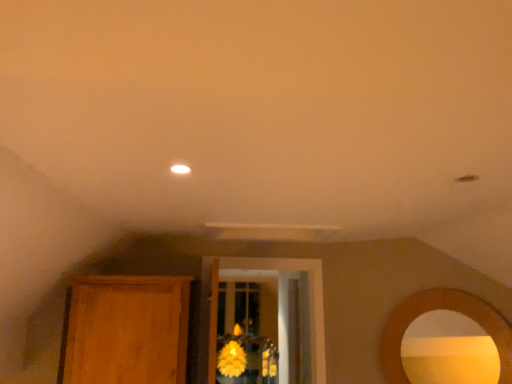
Question: Is wooden armoire at left completely or partially inside yellow matte flower at center?

Choices:
 (A) no
 (B) yes

Answer: (A)

Question: From the image's perspective, is yellow matte flower at center beneath wooden armoire at left?

Choices:
 (A) yes
 (B) no

Answer: (A)

Question: Does yellow matte flower at center come in front of wooden armoire at left?

Choices:
 (A) yes
 (B) no

Answer: (B)

Question: Is yellow matte flower at center to the right of wooden armoire at left from the viewer's perspective?

Choices:
 (A) yes
 (B) no

Answer: (A)

Question: Considering the relative sizes of yellow matte flower at center and wooden armoire at left in the image provided, is yellow matte flower at center smaller than wooden armoire at left?

Choices:
 (A) no
 (B) yes

Answer: (B)

Question: Does yellow matte flower at center have a greater height compared to wooden armoire at left?

Choices:
 (A) no
 (B) yes

Answer: (B)

Question: Is matte gold mirror at right in front of yellow matte flower at center?

Choices:
 (A) no
 (B) yes

Answer: (B)

Question: Would you consider matte gold mirror at right to be distant from yellow matte flower at center?

Choices:
 (A) no
 (B) yes

Answer: (B)

Question: Considering the relative sizes of matte gold mirror at right and yellow matte flower at center in the image provided, is matte gold mirror at right bigger than yellow matte flower at center?

Choices:
 (A) no
 (B) yes

Answer: (A)

Question: Is matte gold mirror at right completely or partially outside of yellow matte flower at center?

Choices:
 (A) yes
 (B) no

Answer: (A)

Question: Is matte gold mirror at right positioned with its back to yellow matte flower at center?

Choices:
 (A) no
 (B) yes

Answer: (A)

Question: Is matte gold mirror at right at the right side of yellow matte flower at center?

Choices:
 (A) no
 (B) yes

Answer: (B)

Question: Considering the relative positions of matte gold mirror at right and wooden armoire at left in the image provided, is matte gold mirror at right to the left of wooden armoire at left from the viewer's perspective?

Choices:
 (A) yes
 (B) no

Answer: (B)